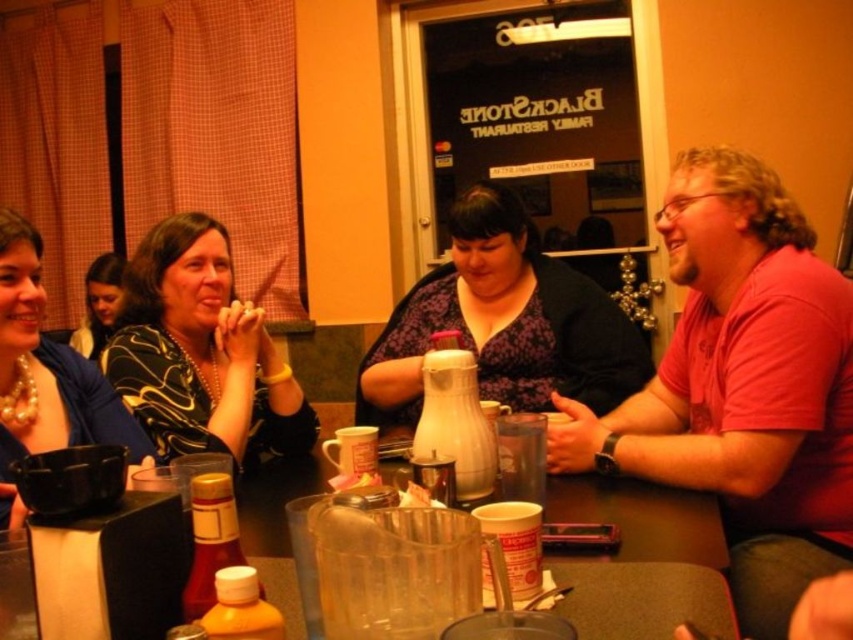
Between black matte dress at center and yellow matte bottle at lower left, which one is positioned lower?

Positioned lower is yellow matte bottle at lower left.

Does black matte dress at center appear on the left side of yellow matte bottle at lower left?

Correct, you'll find black matte dress at center to the left of yellow matte bottle at lower left.

Describe the element at coordinates (201, 352) in the screenshot. I see `black matte dress at center` at that location.

Image resolution: width=853 pixels, height=640 pixels. In order to click on black matte dress at center in this screenshot , I will do 201,352.

In the scene shown: Can you confirm if yellow matte bottle at lower left is positioned to the left of matte black shirt at upper left?

Incorrect, yellow matte bottle at lower left is not on the left side of matte black shirt at upper left.

Which is above, yellow matte bottle at lower left or matte black shirt at upper left?

Positioned higher is matte black shirt at upper left.

Where is `yellow matte bottle at lower left`? This screenshot has height=640, width=853. yellow matte bottle at lower left is located at coordinates (241, 609).

Can you confirm if matte black shirt at center is taller than black matte dress at center?

Indeed, matte black shirt at center has a greater height compared to black matte dress at center.

Who is more forward, (486, 321) or (111, 353)?

Point (111, 353)

Is point (413, 323) closer to viewer compared to point (213, 408)?

No, (413, 323) is behind (213, 408).

Image resolution: width=853 pixels, height=640 pixels. I want to click on matte black shirt at center, so click(503, 323).